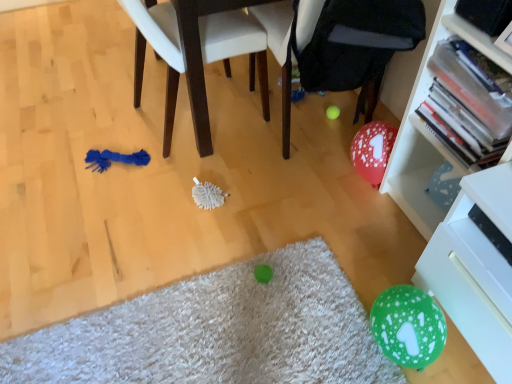
Where is `free space between blue fabric chair at left and white bristle brush at center`? free space between blue fabric chair at left and white bristle brush at center is located at coordinates (210, 171).